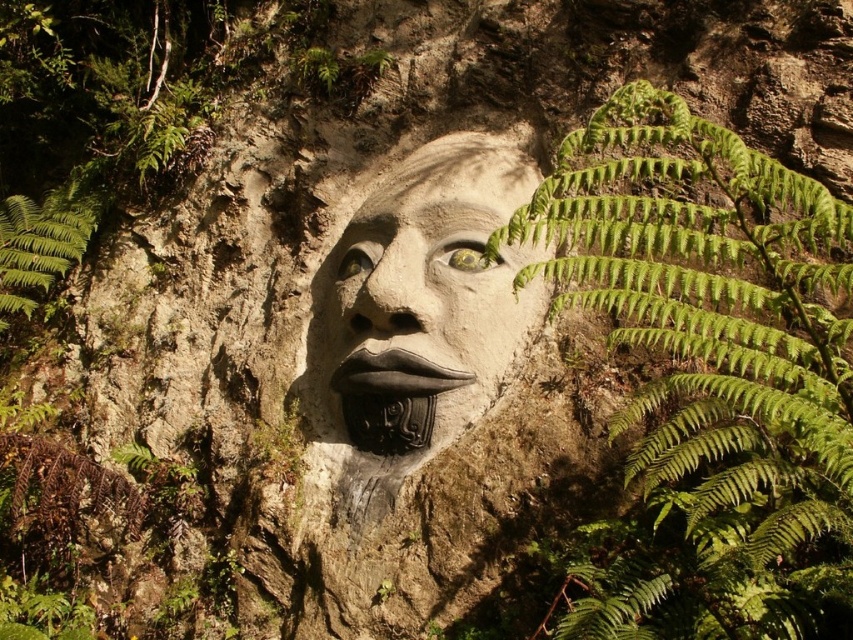
Question: Is matte stone face at center below black glossy lips at center?

Choices:
 (A) yes
 (B) no

Answer: (B)

Question: Which object appears closest to the camera in this image?

Choices:
 (A) green leafy fern at right
 (B) green leafy fern at left
 (C) matte stone face at center
 (D) black glossy lips at center

Answer: (A)

Question: Among these points, which one is nearest to the camera?

Choices:
 (A) pyautogui.click(x=331, y=420)
 (B) pyautogui.click(x=28, y=282)
 (C) pyautogui.click(x=749, y=244)
 (D) pyautogui.click(x=337, y=368)

Answer: (C)

Question: Is matte stone face at center bigger than green leafy fern at left?

Choices:
 (A) yes
 (B) no

Answer: (A)

Question: Which point appears closest to the camera in this image?

Choices:
 (A) (376, 388)
 (B) (587, 154)
 (C) (479, 221)

Answer: (A)

Question: Is matte stone face at center positioned in front of black glossy lips at center?

Choices:
 (A) yes
 (B) no

Answer: (B)